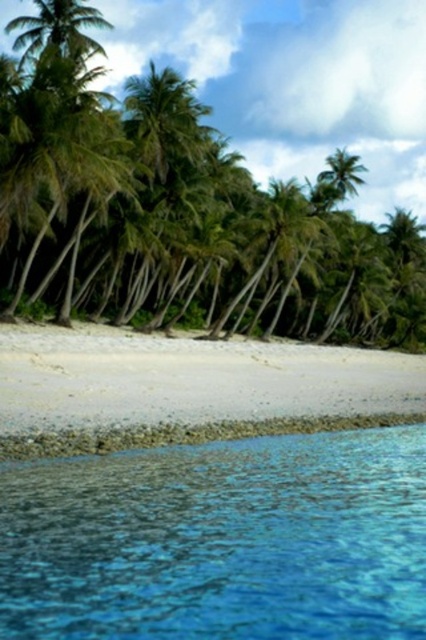
I want to click on clear blue water at lower center, so click(x=219, y=540).

The image size is (426, 640). I want to click on clear blue water at lower center, so click(x=219, y=540).